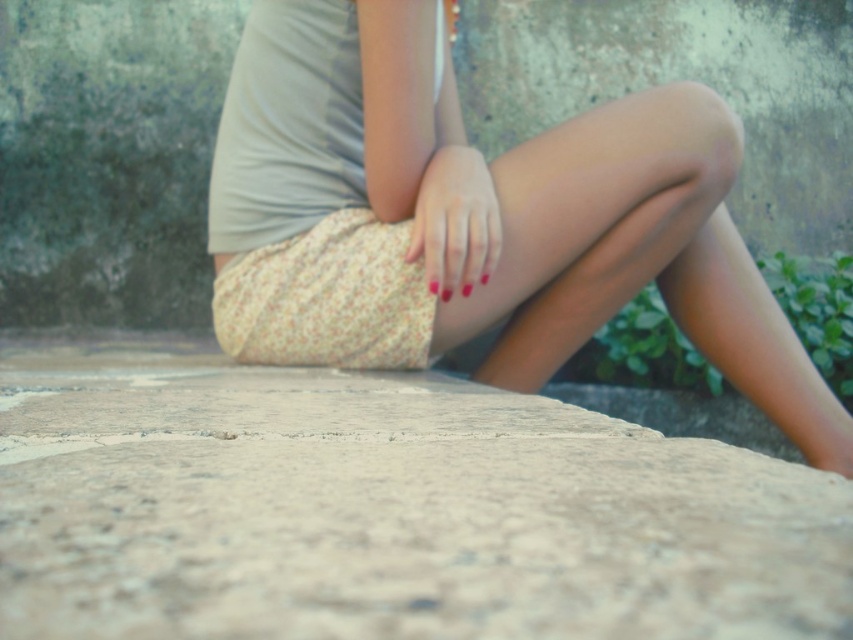
Between smooth stone surface at center and smooth matte hand at center, which one appears on the right side from the viewer's perspective?

Positioned to the right is smooth matte hand at center.

From the picture: Does smooth stone surface at center have a larger size compared to smooth matte hand at center?

Yes.

Does point (550, 493) come farther from viewer compared to point (460, 209)?

No, it is in front of (460, 209).

Find the location of a particular element. Image resolution: width=853 pixels, height=640 pixels. smooth stone surface at center is located at coordinates (386, 509).

Does floral fabric skirt at center have a smaller size compared to smooth matte hand at center?

No.

Is floral fabric skirt at center to the right of smooth matte hand at center from the viewer's perspective?

Yes, floral fabric skirt at center is to the right of smooth matte hand at center.

Who is more forward, (300, 163) or (474, 193)?

Positioned in front is point (474, 193).

The width and height of the screenshot is (853, 640). I want to click on floral fabric skirt at center, so click(560, 221).

Does smooth stone surface at center have a smaller size compared to floral fabric skirt at center?

Yes.

Who is higher up, smooth stone surface at center or floral fabric skirt at center?

floral fabric skirt at center is higher up.

I want to click on smooth stone surface at center, so click(x=386, y=509).